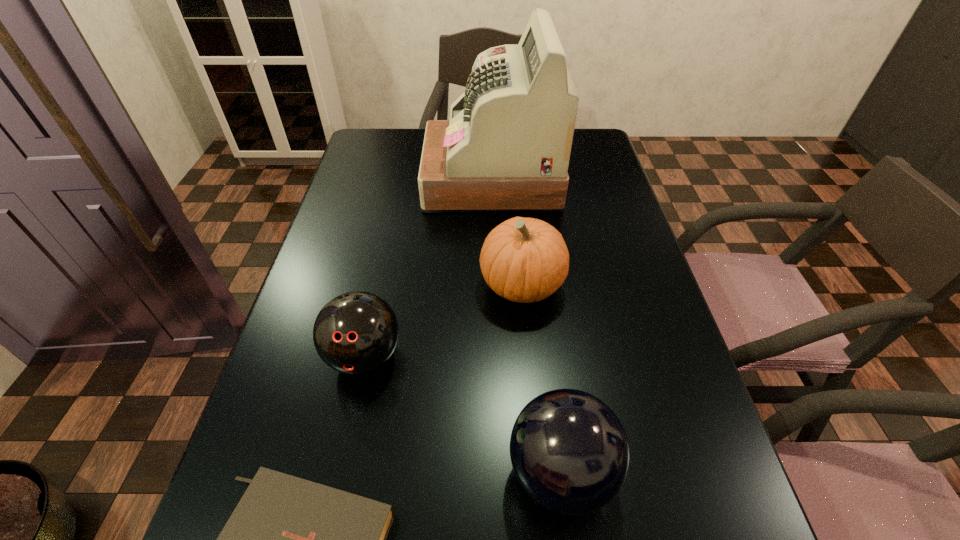
Find the location of a particular element. This screenshot has height=540, width=960. blank space that satisfies the following two spatial constraints: 1. on the stem of the pumpkin; 2. on the surface of the farther bowling ball near the finger holes is located at coordinates (528, 356).

Find the location of `vacant point that satisfies the following two spatial constraints: 1. on the stem of the second farthest object; 2. on the surface of the left bowling ball near the finger holes`. vacant point that satisfies the following two spatial constraints: 1. on the stem of the second farthest object; 2. on the surface of the left bowling ball near the finger holes is located at coordinates (528, 356).

Locate an element on the screen. vacant point that satisfies the following two spatial constraints: 1. on the stem of the fourth nearest object; 2. on the surface of the farther bowling ball near the finger holes is located at coordinates (528, 356).

Where is `free location that satisfies the following two spatial constraints: 1. on the stem of the pumpkin; 2. on the surface of the third nearest object near the finger holes`? This screenshot has width=960, height=540. free location that satisfies the following two spatial constraints: 1. on the stem of the pumpkin; 2. on the surface of the third nearest object near the finger holes is located at coordinates (528, 356).